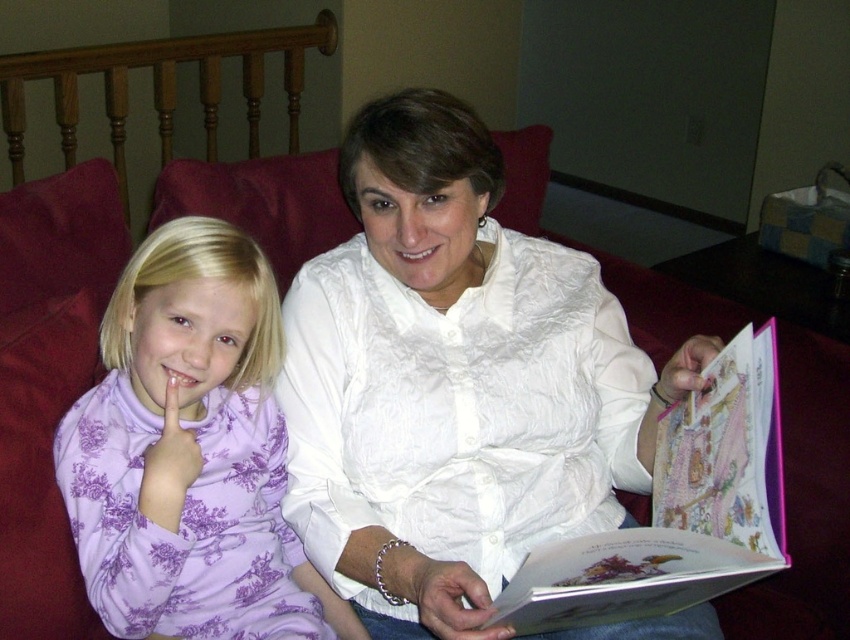
Question: Considering the relative positions of purple floral dress at left and pink paper book at center in the image provided, where is purple floral dress at left located with respect to pink paper book at center?

Choices:
 (A) below
 (B) above

Answer: (B)

Question: Which of the following is the farthest from the observer?

Choices:
 (A) (341, 272)
 (B) (748, 428)
 (C) (416, 241)
 (D) (204, 376)

Answer: (A)

Question: Is purple floral dress at left thinner than smooth white teeth at center?

Choices:
 (A) yes
 (B) no

Answer: (B)

Question: Is pink paper book at center positioned in front of pink matte lips at center?

Choices:
 (A) yes
 (B) no

Answer: (A)

Question: Which of these objects is positioned farthest from the pink paper book at center?

Choices:
 (A) smooth white teeth at center
 (B) white textured blouse at center
 (C) purple floral dress at left
 (D) pink matte lips at center

Answer: (D)

Question: Among these objects, which one is farthest from the camera?

Choices:
 (A) pink matte lips at center
 (B) purple floral dress at left
 (C) pink paper book at center

Answer: (A)